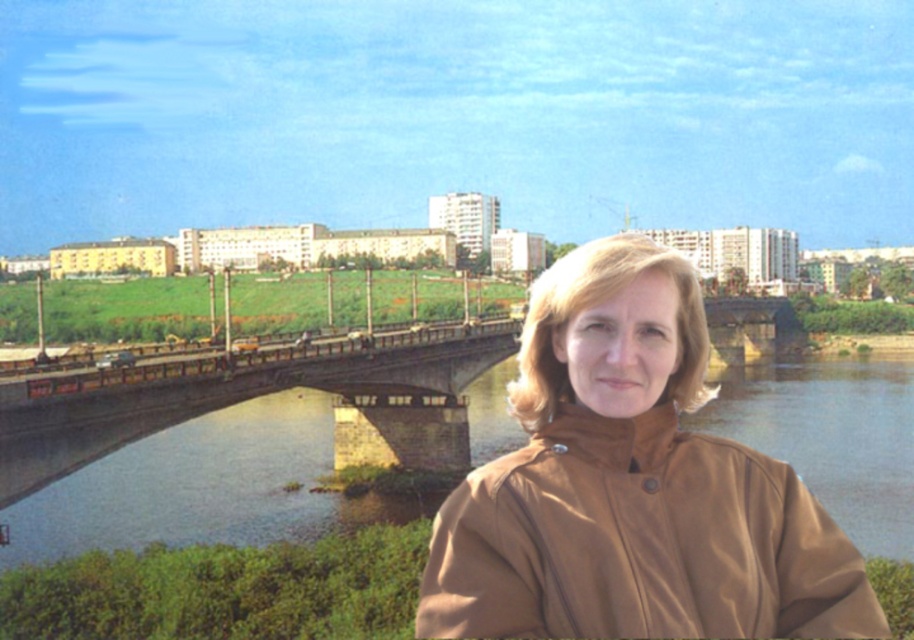
You are a photographer trying to capture the brown matte trench coat at lower right and the brown stone bridge at center in the same frame. Based on their positions, which object is closer to the camera?

The brown matte trench coat at lower right is closer to the camera because it is positioned above the brown stone bridge at center in the scene.

You are a photographer trying to capture the brown matte trench coat at lower right in your shot. The camera you are using has a focal length of 50mm and an aperture of f2.8. You want to ensure that the entire bridge and the grassy area with trees are also visible in the frame. Is the current camera setting sufficient to capture all these elements in focus? Please explain your reasoning based on the scene description.

The camera settings of 50mm focal length and f2.8 aperture may not be sufficient to keep both the brown matte trench coat at lower right and the distant bridge and grassy area in focus simultaneously. A wider depth of field is needed for such a composition. Consider using a smaller aperture like f8 or f11 to increase the depth of field, ensuring all elements are sharp.